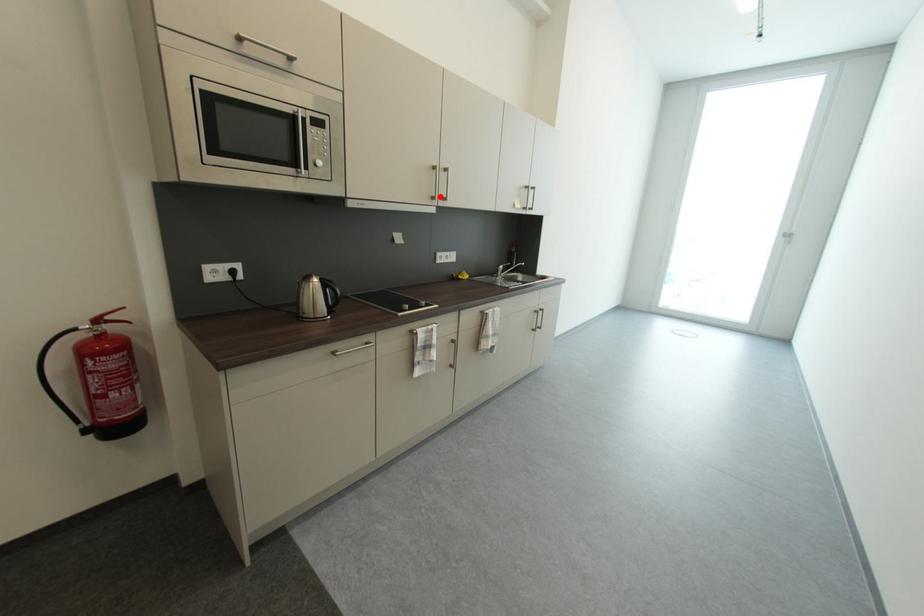
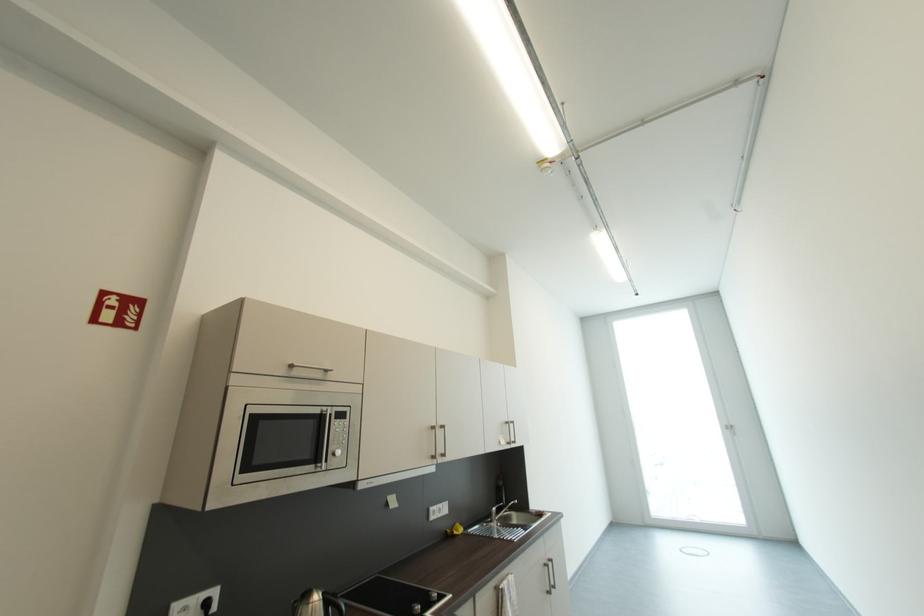
Question: I am providing you with two images of the same scene from different viewpoints. Image1 has a red point marked. In image2, the corresponding 3D location appears at what relative position? Reply with the corresponding letter.

Choices:
 (A) Closer
 (B) Farther

Answer: (B)